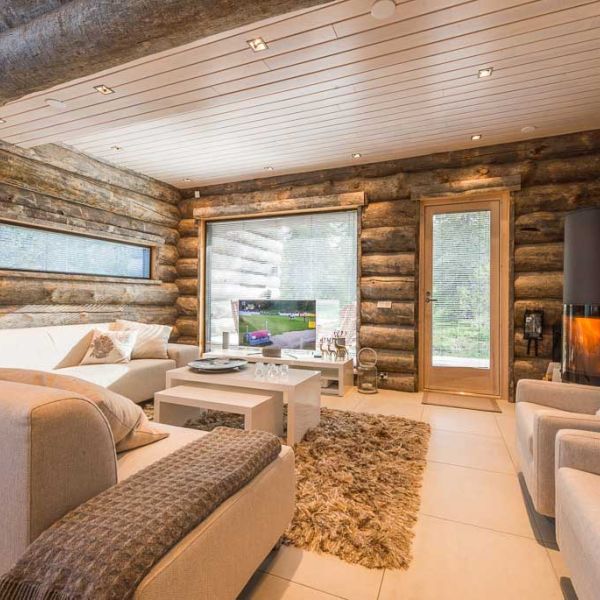
You are a GUI agent. You are given a task and a screenshot of the screen. Output one action in this format:
    pyautogui.click(x=<x>, y=<y>)
    Task: Click on the sofa throw
    The width and height of the screenshot is (600, 600).
    Given the screenshot: What is the action you would take?
    pyautogui.click(x=152, y=512)